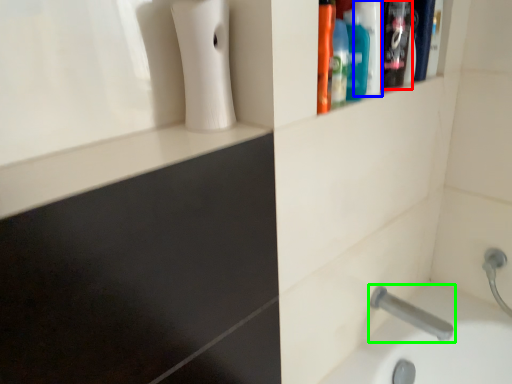
Question: Estimate the real-world distances between objects in this image. Which object is closer to cleaning product (highlighted by a red box), mouthwash (highlighted by a blue box) or tap (highlighted by a green box)?

Choices:
 (A) mouthwash
 (B) tap

Answer: (A)